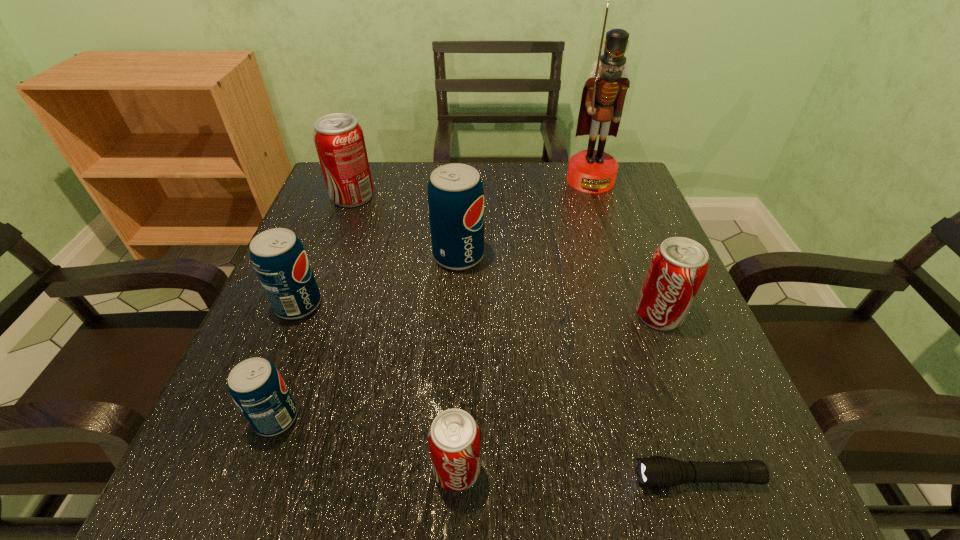
Image resolution: width=960 pixels, height=540 pixels. Find the location of `free space located 0.120m on the left of the nearest red soda can`. free space located 0.120m on the left of the nearest red soda can is located at coordinates (348, 470).

The width and height of the screenshot is (960, 540). Find the location of `free space located 0.280m at the lens end of the flashlight`. free space located 0.280m at the lens end of the flashlight is located at coordinates (433, 478).

Identify the location of free location located at the lens end of the flashlight. This screenshot has height=540, width=960. (592, 478).

Where is `free space located 0.050m at the lens end of the flashlight`? The image size is (960, 540). free space located 0.050m at the lens end of the flashlight is located at coordinates (x=600, y=478).

Locate an element on the screen. The height and width of the screenshot is (540, 960). nutcracker present at the far edge is located at coordinates (x=593, y=171).

Where is `soda can located at the far edge`? soda can located at the far edge is located at coordinates (339, 140).

The height and width of the screenshot is (540, 960). I want to click on soda can situated at the near edge, so click(x=454, y=438).

Locate an element on the screen. This screenshot has width=960, height=540. flashlight present at the near edge is located at coordinates (656, 471).

I want to click on nutcracker located at the right edge, so click(593, 171).

Identify the location of soda can present at the right edge. (678, 266).